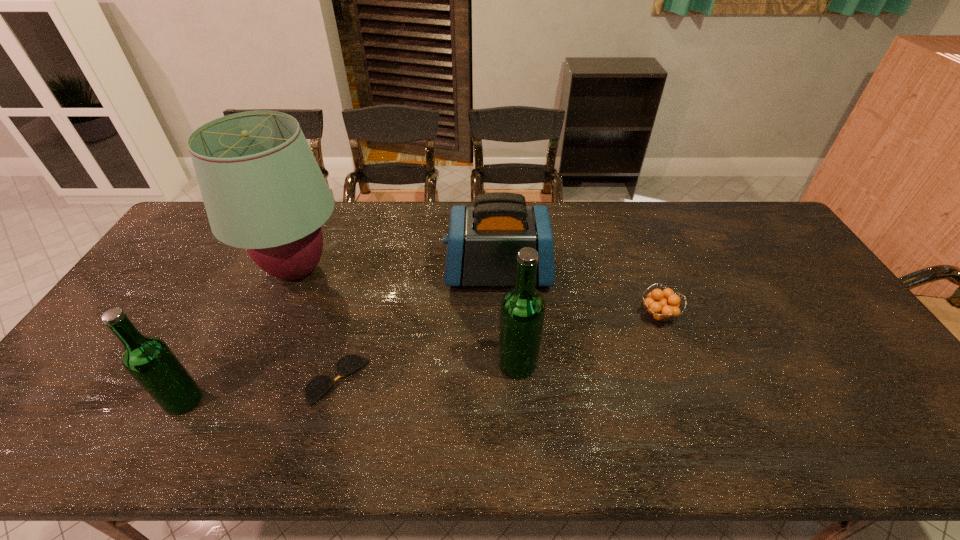
Where is `free space at the far edge`? Image resolution: width=960 pixels, height=540 pixels. free space at the far edge is located at coordinates (722, 221).

At what (x,y) coordinates should I click in order to perform the action: click on free space at the near edge. Please return your answer as a coordinate pair (x, y). This screenshot has height=540, width=960. Looking at the image, I should click on (476, 384).

In the image, there is a desktop. In order to click on free space at the right edge in this screenshot , I will do `click(813, 349)`.

This screenshot has height=540, width=960. I want to click on free space at the near left corner of the desktop, so click(96, 409).

The width and height of the screenshot is (960, 540). Find the location of `vacant space at the far right corner of the desktop`. vacant space at the far right corner of the desktop is located at coordinates point(737,201).

The height and width of the screenshot is (540, 960). I want to click on vacant area between the shorter beer bottle and the farther beer bottle, so click(350, 382).

The width and height of the screenshot is (960, 540). Identify the location of vacant region between the tallest object and the shorter beer bottle. (240, 335).

Where is `vacant space that's between the toaster and the rightmost object`? The height and width of the screenshot is (540, 960). vacant space that's between the toaster and the rightmost object is located at coordinates (578, 294).

Image resolution: width=960 pixels, height=540 pixels. Find the location of `empty space that is in between the tallest object and the nearer beer bottle`. empty space that is in between the tallest object and the nearer beer bottle is located at coordinates (240, 335).

This screenshot has width=960, height=540. In order to click on vacant region between the rightmost object and the left beer bottle in this screenshot , I will do `click(420, 357)`.